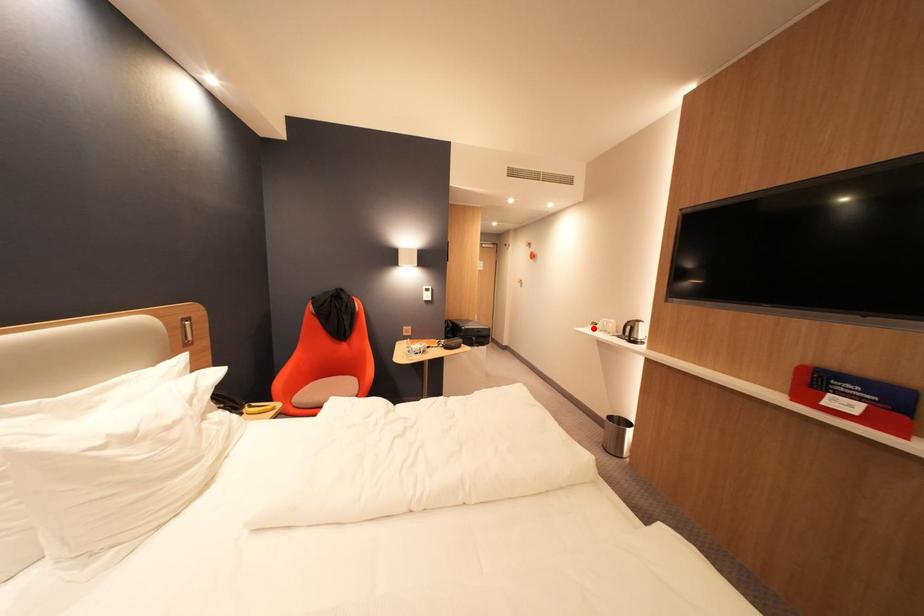
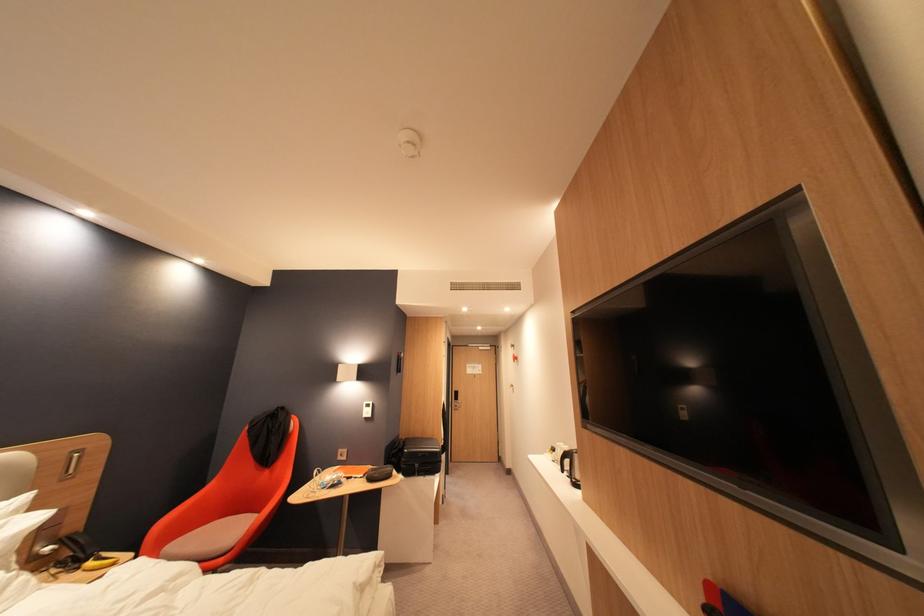
Where in the second image is the point corresponding to the highlighted location from the first image?

(553, 455)